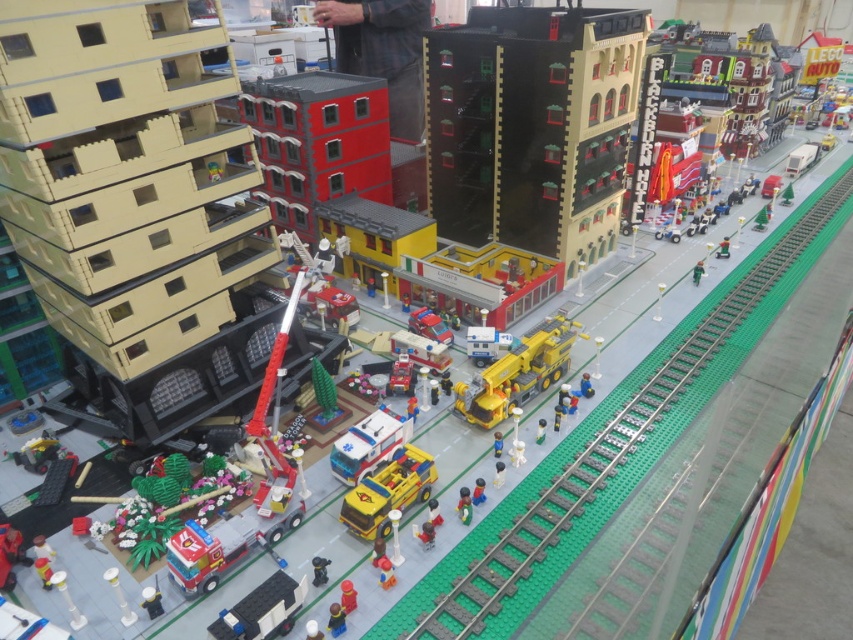
Which is above, dark blue shirt at center or yellow plastic crane at center?

dark blue shirt at center is above.

Can you confirm if dark blue shirt at center is wider than yellow plastic crane at center?

Correct, the width of dark blue shirt at center exceeds that of yellow plastic crane at center.

Is point (341, 28) less distant than point (485, 374)?

No.

I want to click on dark blue shirt at center, so click(x=383, y=51).

Which is more to the right, smooth yellow helmet at lower left or green matte figure at lower right?

green matte figure at lower right

Where is `smooth yellow helmet at lower left`? smooth yellow helmet at lower left is located at coordinates (42, 561).

The height and width of the screenshot is (640, 853). In order to click on smooth yellow helmet at lower left in this screenshot , I will do `click(42, 561)`.

Which is below, smooth plastic figure at lower center or light blue plastic figure at center?

smooth plastic figure at lower center is lower down.

Which of these two, smooth plastic figure at lower center or light blue plastic figure at center, stands taller?

light blue plastic figure at center

Who is more forward, (335, 614) or (579, 381)?

Point (335, 614)

Identify the location of smooth plastic figure at lower center. This screenshot has width=853, height=640. (335, 620).